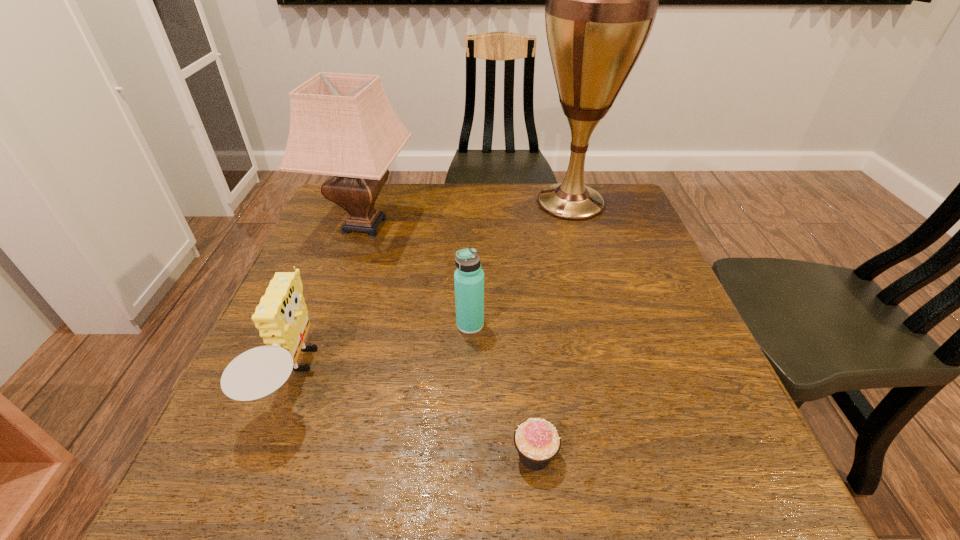
I want to click on vacant region at the far edge of the desktop, so click(x=514, y=225).

Image resolution: width=960 pixels, height=540 pixels. Identify the location of free spot at the near edge of the desktop. (486, 501).

This screenshot has height=540, width=960. I want to click on vacant area at the left edge of the desktop, so click(307, 443).

At what (x,y) coordinates should I click in order to perform the action: click on vacant space at the right edge. Please return your answer as a coordinate pair (x, y). This screenshot has width=960, height=540. Looking at the image, I should click on (718, 374).

I want to click on blank space at the near left corner of the desktop, so click(204, 454).

You are a GUI agent. You are given a task and a screenshot of the screen. Output one action in this format:
    pyautogui.click(x=<x>, y=<y>)
    Task: Click on the vacant space at the far right corner of the desktop
    
    Given the screenshot: What is the action you would take?
    pyautogui.click(x=597, y=220)

Where is `vacant area at the near right corner`? The image size is (960, 540). vacant area at the near right corner is located at coordinates (689, 480).

You are a GUI agent. You are given a task and a screenshot of the screen. Output one action in this format:
    pyautogui.click(x=<x>, y=<y>)
    Task: Click on the vacant area between the third object from right to left and the sponge
    This screenshot has height=540, width=960.
    Given the screenshot: What is the action you would take?
    pyautogui.click(x=383, y=350)

Where is `free spot between the lampshade and the sponge`? The image size is (960, 540). free spot between the lampshade and the sponge is located at coordinates (330, 301).

Where is `free space between the third object from left to right and the tallest object`? The height and width of the screenshot is (540, 960). free space between the third object from left to right and the tallest object is located at coordinates (520, 264).